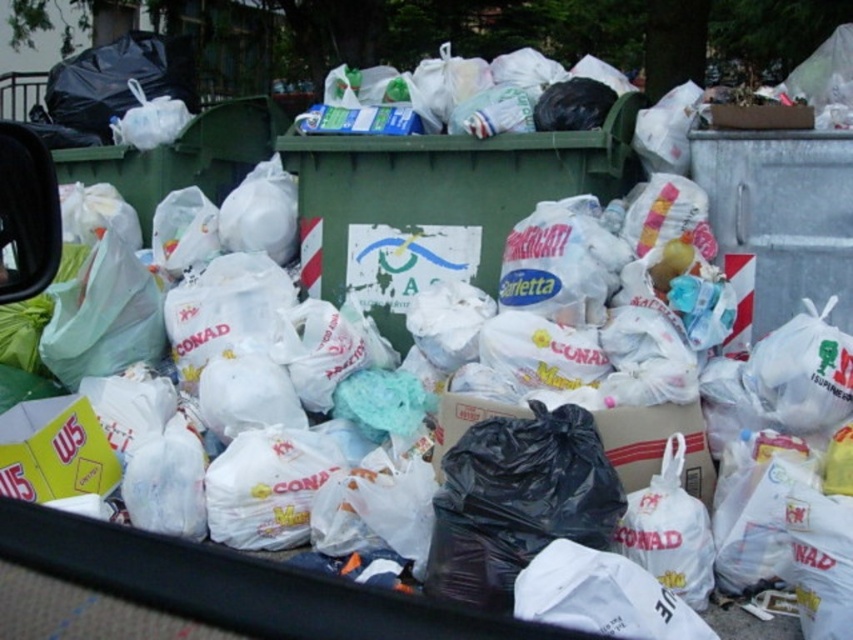
Question: Which object is farther from the camera taking this photo?

Choices:
 (A) green plastic recycling bin at center
 (B) metallic gray recycling bin at upper right

Answer: (A)

Question: Is green plastic recycling bin at center smaller than metallic gray recycling bin at upper right?

Choices:
 (A) no
 (B) yes

Answer: (A)

Question: Is green plastic recycling bin at center closer to camera compared to metallic gray recycling bin at upper right?

Choices:
 (A) yes
 (B) no

Answer: (B)

Question: Which point is closer to the camera?

Choices:
 (A) metallic gray recycling bin at upper right
 (B) green plastic recycling bin at center

Answer: (A)

Question: Is the position of green plastic recycling bin at center less distant than that of metallic gray recycling bin at upper right?

Choices:
 (A) no
 (B) yes

Answer: (A)

Question: Which point is closer to the camera?

Choices:
 (A) (421, 172)
 (B) (730, 228)

Answer: (B)